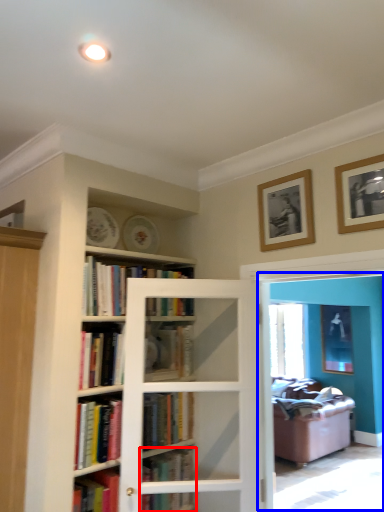
Question: Which of the following is the closest to the observer, book (highlighted by a red box) or screen door (highlighted by a blue box)?

Choices:
 (A) book
 (B) screen door

Answer: (B)